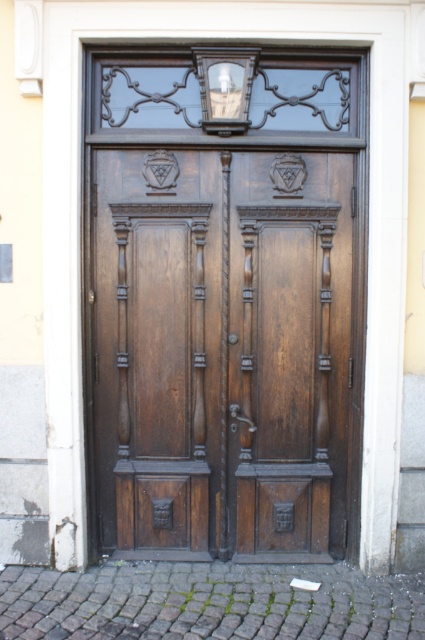
Question: Which point appears closest to the camera in this image?

Choices:
 (A) (249, 100)
 (B) (345, 266)

Answer: (A)

Question: Is polished wood door at center smaller than matte glass lamp at upper center?

Choices:
 (A) yes
 (B) no

Answer: (B)

Question: Considering the relative positions of polished wood door at center and matte glass lamp at upper center in the image provided, where is polished wood door at center located with respect to matte glass lamp at upper center?

Choices:
 (A) above
 (B) below

Answer: (B)

Question: Is polished wood door at center below matte glass lamp at upper center?

Choices:
 (A) yes
 (B) no

Answer: (A)